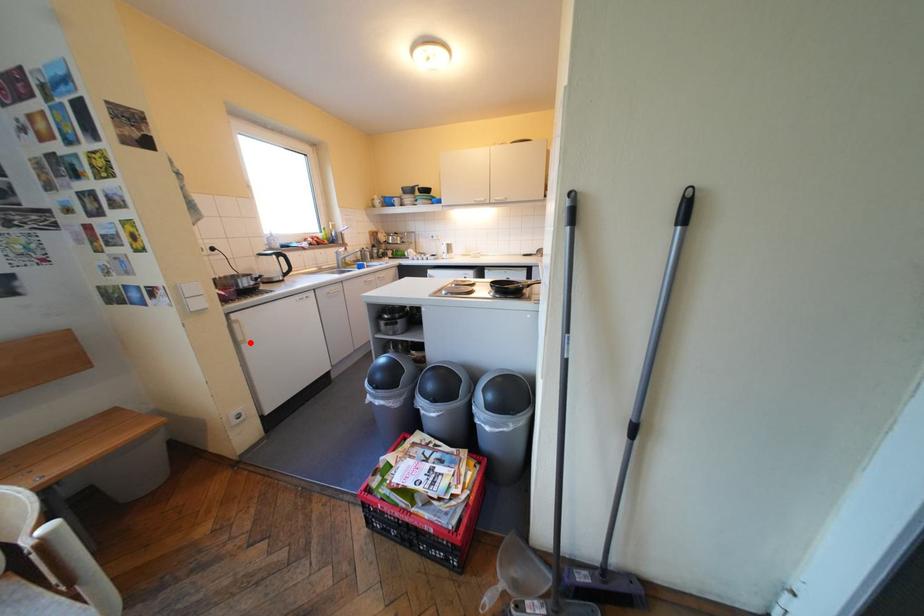
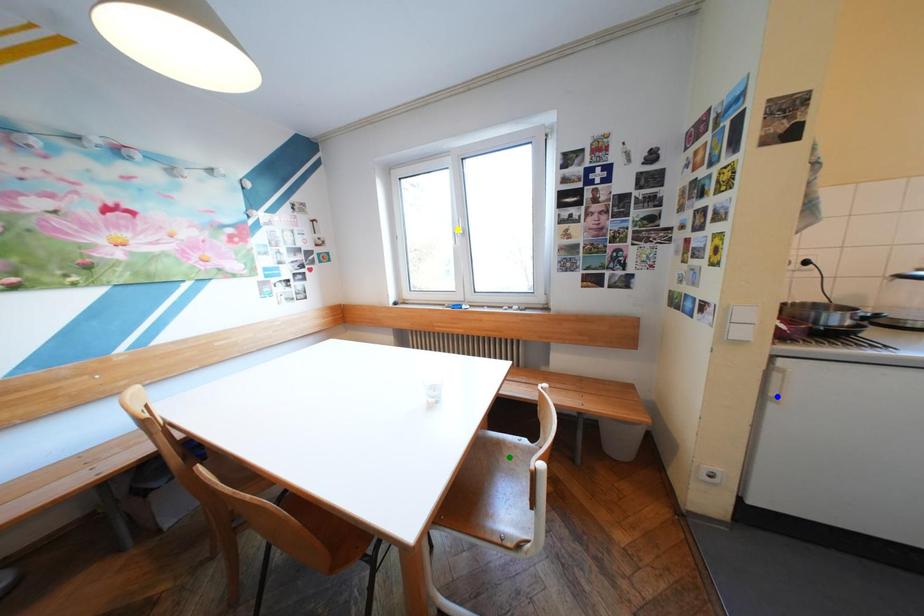
Question: I am providing you with two images of the same scene from different viewpoints. A red point is marked on the first image. You are given multiple points on the second image. In image 2, which mark is for the same physical point as the one in image 1?

Choices:
 (A) yellow point
 (B) blue point
 (C) green point

Answer: (B)